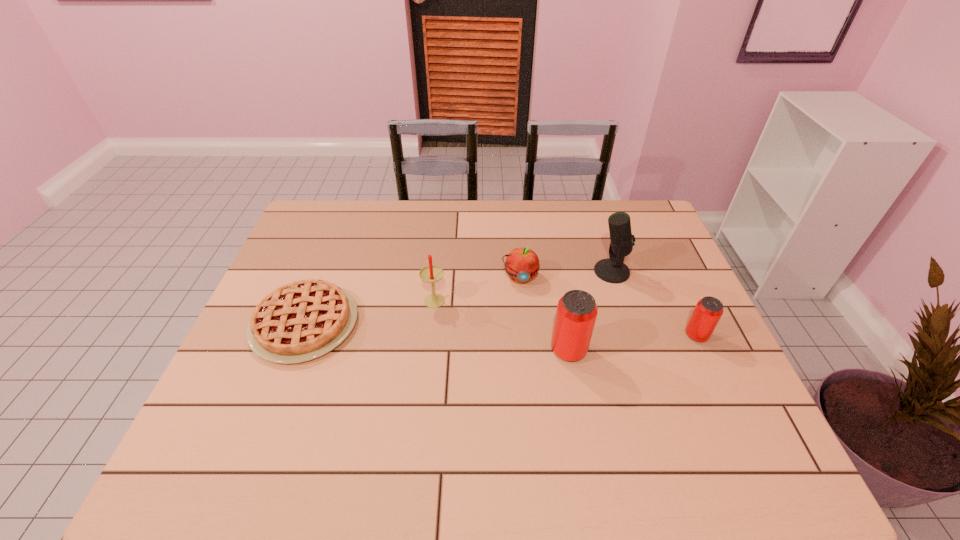
At what (x,y) coordinates should I click in order to perform the action: click on vacant space located on the left of the rightmost object. Please return your answer as a coordinate pair (x, y). Looking at the image, I should click on (639, 335).

Identify the location of free spot located on the front of the third object from left to right. pyautogui.click(x=530, y=382).

At what (x,y) coordinates should I click in order to perform the action: click on vacant space situated 0.110m on the right of the shortest object. Please return your answer as a coordinate pair (x, y). The height and width of the screenshot is (540, 960). Looking at the image, I should click on (398, 323).

You are a GUI agent. You are given a task and a screenshot of the screen. Output one action in this format:
    pyautogui.click(x=<x>, y=<y>)
    Task: Click on the free spot located on the left of the microphone
    Image resolution: width=960 pixels, height=540 pixels.
    Given the screenshot: What is the action you would take?
    pyautogui.click(x=568, y=272)

Identify the location of vacant space located on the front of the candle. The width and height of the screenshot is (960, 540). (428, 356).

Find the location of a particular element. This screenshot has width=960, height=540. object present at the left edge is located at coordinates (300, 321).

Image resolution: width=960 pixels, height=540 pixels. What are the coordinates of `can that is positioned at the right edge` in the screenshot? It's located at point(708,311).

You are a GUI agent. You are given a task and a screenshot of the screen. Output one action in this format:
    pyautogui.click(x=<x>, y=<y>)
    Task: Click on the microphone that is at the right edge
    
    Given the screenshot: What is the action you would take?
    pyautogui.click(x=612, y=270)

Identify the location of free location at the far edge of the desktop. (481, 230).

Image resolution: width=960 pixels, height=540 pixels. Find the location of `vacant space at the near edge`. vacant space at the near edge is located at coordinates (588, 415).